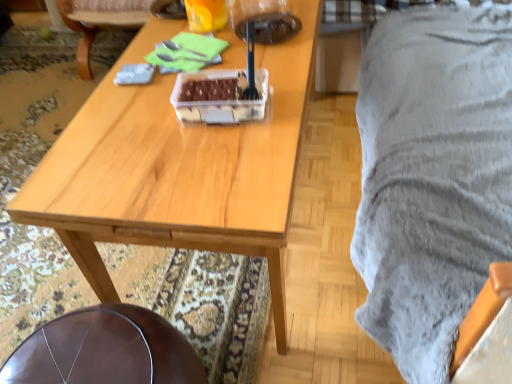
Locate an element on the screen. The image size is (512, 384). free space above wooden table at center (from a real-world perspective) is located at coordinates (187, 71).